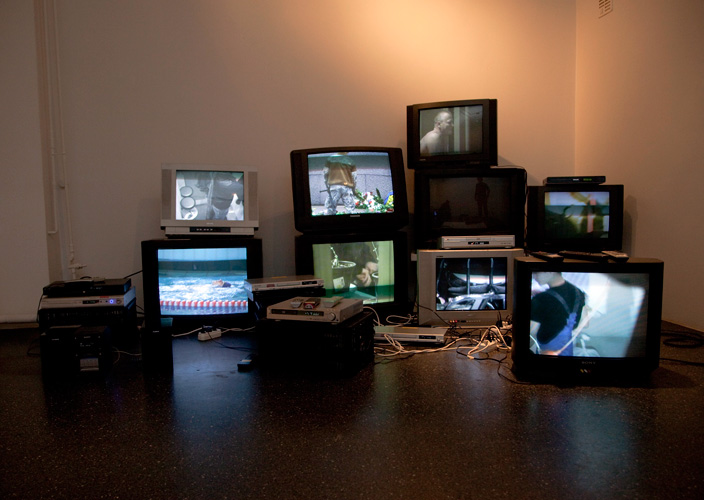
At what (x,y) coordinates should I click in order to perform the action: click on man on tv screen. Please return your answer as a coordinate pair (x, y). Looking at the image, I should click on (432, 135).